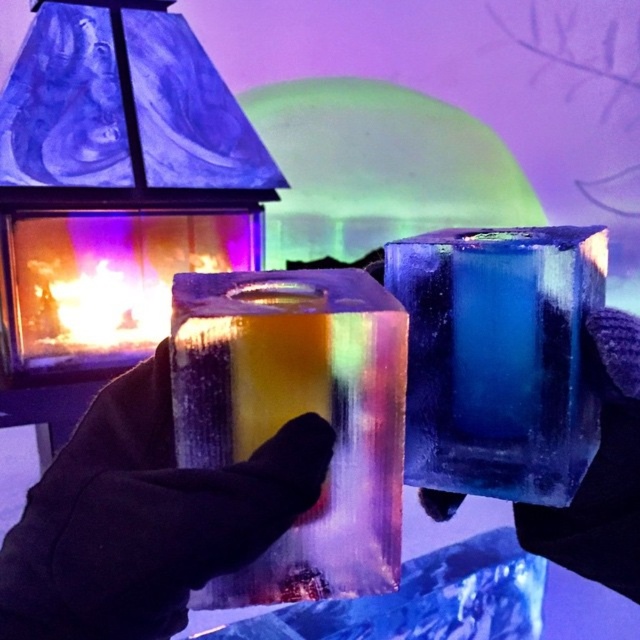
Is translucent ice cube at center shorter than translucent rainbow ice cube at center?

No.

Is translucent ice cube at center further to camera compared to translucent rainbow ice cube at center?

Yes, it is behind translucent rainbow ice cube at center.

Image resolution: width=640 pixels, height=640 pixels. What are the coordinates of `translucent ice cube at center` in the screenshot? It's located at point(115,186).